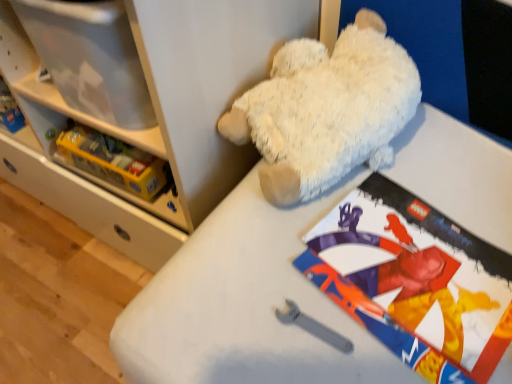
Where is `matte paper comic book at upper center`? matte paper comic book at upper center is located at coordinates (414, 281).

Where is `white plush teddy bear at upper center`? This screenshot has width=512, height=384. white plush teddy bear at upper center is located at coordinates 326,109.

The image size is (512, 384). Describe the element at coordinates (73, 111) in the screenshot. I see `yellow plastic lego box at left, arranged as the 1th shelf when viewed from the back` at that location.

The width and height of the screenshot is (512, 384). Find the location of `white plush bear at upper right, the second shelf when ordered from back to front`. white plush bear at upper right, the second shelf when ordered from back to front is located at coordinates (156, 114).

Where is `matte paper comic book at upper center`? matte paper comic book at upper center is located at coordinates (414, 281).

Considering the relative positions of white plush teddy bear at upper center and matte paper comic book at upper center in the image provided, is white plush teddy bear at upper center in front of matte paper comic book at upper center?

No, it is not.

Is white plush teddy bear at upper center next to matte paper comic book at upper center and touching it?

No, white plush teddy bear at upper center is not beside matte paper comic book at upper center.

What's the angular difference between white plush teddy bear at upper center and matte paper comic book at upper center's facing directions?

They differ by 6.56 degrees in their facing directions.

Is white plush teddy bear at upper center wider than matte paper comic book at upper center?

Correct, the width of white plush teddy bear at upper center exceeds that of matte paper comic book at upper center.

From a real-world perspective, is yellow plastic lego box at left, the second shelf in the front-to-back sequence, over white plush teddy bear at upper center?

Actually, yellow plastic lego box at left, the second shelf in the front-to-back sequence, is physically below white plush teddy bear at upper center in the real world.

Does yellow plastic lego box at left, arranged as the 1th shelf when viewed from the back, have a smaller size compared to white plush teddy bear at upper center?

Yes.

What's the angular difference between yellow plastic lego box at left, the second shelf in the front-to-back sequence, and white plush teddy bear at upper center's facing directions?

There is a 5.17-degree angle between the facing directions of yellow plastic lego box at left, the second shelf in the front-to-back sequence, and white plush teddy bear at upper center.

From a real-world perspective, which shelf is the 2nd one underneath the white plush teddy bear at upper center? Please provide its 2D coordinates.

[(73, 111)]

Considering the positions of point (429, 208) and point (168, 5), is point (429, 208) closer or farther from the camera than point (168, 5)?

Point (429, 208) is positioned farther from the camera compared to point (168, 5).

Is matte paper comic book at upper center at the left side of white plush bear at upper right, the second shelf when ordered from back to front?

No, matte paper comic book at upper center is not to the left of white plush bear at upper right, the second shelf when ordered from back to front.

Does matte paper comic book at upper center turn towards white plush bear at upper right, the second shelf when ordered from back to front?

No, matte paper comic book at upper center does not turn towards white plush bear at upper right, the second shelf when ordered from back to front.

How different are the orientations of matte paper comic book at upper center and white plush bear at upper right, acting as the first shelf starting from the front, in degrees?

There is a 8.73-degree angle between the facing directions of matte paper comic book at upper center and white plush bear at upper right, acting as the first shelf starting from the front.

Are white plush bear at upper right, the second shelf when ordered from back to front, and white plush teddy bear at upper center making contact?

No, white plush bear at upper right, the second shelf when ordered from back to front, is not making contact with white plush teddy bear at upper center.

Which object is positioned more to the right, white plush bear at upper right, acting as the first shelf starting from the front, or white plush teddy bear at upper center?

From the viewer's perspective, white plush teddy bear at upper center appears more on the right side.

How different are the orientations of white plush bear at upper right, acting as the first shelf starting from the front, and white plush teddy bear at upper center in degrees?

white plush bear at upper right, acting as the first shelf starting from the front, and white plush teddy bear at upper center are facing 2.17 degrees away from each other.

Considering the sizes of objects yellow plastic lego box at left, the second shelf in the front-to-back sequence, and white plush bear at upper right, acting as the first shelf starting from the front, in the image provided, who is wider, yellow plastic lego box at left, the second shelf in the front-to-back sequence, or white plush bear at upper right, acting as the first shelf starting from the front,?

Wider between the two is white plush bear at upper right, acting as the first shelf starting from the front.

From a real-world perspective, is yellow plastic lego box at left, the second shelf in the front-to-back sequence, physically located above or below white plush bear at upper right, acting as the first shelf starting from the front?

yellow plastic lego box at left, the second shelf in the front-to-back sequence, is situated lower than white plush bear at upper right, acting as the first shelf starting from the front, in the real world.

Which is behind, point (182, 214) or point (178, 39)?

The point (182, 214) is farther from the camera.

Is yellow plastic lego box at left, arranged as the 1th shelf when viewed from the back, positioned far away from white plush bear at upper right, the second shelf when ordered from back to front?

That's not correct — yellow plastic lego box at left, arranged as the 1th shelf when viewed from the back, is a little close to white plush bear at upper right, the second shelf when ordered from back to front.

From the image's perspective, which is above, white plush bear at upper right, the second shelf when ordered from back to front, or matte paper comic book at upper center?

white plush bear at upper right, the second shelf when ordered from back to front, appears higher in the image.

Consider the image. Is white plush bear at upper right, the second shelf when ordered from back to front, directly adjacent to matte paper comic book at upper center?

white plush bear at upper right, the second shelf when ordered from back to front, and matte paper comic book at upper center are clearly separated.

Does white plush bear at upper right, acting as the first shelf starting from the front, have a lesser height compared to matte paper comic book at upper center?

No, white plush bear at upper right, acting as the first shelf starting from the front, is not shorter than matte paper comic book at upper center.

From the image's perspective, who appears lower, white plush bear at upper right, the second shelf when ordered from back to front, or yellow plastic lego box at left, arranged as the 1th shelf when viewed from the back?

yellow plastic lego box at left, arranged as the 1th shelf when viewed from the back, is shown below in the image.

Looking at this image, does white plush bear at upper right, the second shelf when ordered from back to front, have a lesser height compared to yellow plastic lego box at left, the second shelf in the front-to-back sequence?

No, white plush bear at upper right, the second shelf when ordered from back to front, is not shorter than yellow plastic lego box at left, the second shelf in the front-to-back sequence.

Which object is positioned more to the left, white plush bear at upper right, the second shelf when ordered from back to front, or yellow plastic lego box at left, the second shelf in the front-to-back sequence?

white plush bear at upper right, the second shelf when ordered from back to front.

This screenshot has height=384, width=512. Find the location of `teddy bear on the left of the matte paper comic book at upper center`. teddy bear on the left of the matte paper comic book at upper center is located at coordinates (326, 109).

From a real-world perspective, which shelf is the 2nd one underneath the white plush teddy bear at upper center? Please provide its 2D coordinates.

[(73, 111)]

Based on their spatial positions, is matte paper comic book at upper center or white plush bear at upper right, the second shelf when ordered from back to front, further from yellow plastic lego box at left, the second shelf in the front-to-back sequence?

The object further to yellow plastic lego box at left, the second shelf in the front-to-back sequence, is matte paper comic book at upper center.

From the image, which object appears to be farther from white plush bear at upper right, acting as the first shelf starting from the front, yellow plastic lego box at left, arranged as the 1th shelf when viewed from the back, or white plush teddy bear at upper center?

Based on the image, white plush teddy bear at upper center appears to be further to white plush bear at upper right, acting as the first shelf starting from the front.

Which object lies nearer to the anchor point matte paper comic book at upper center, yellow plastic lego box at left, arranged as the 1th shelf when viewed from the back, or white plush bear at upper right, acting as the first shelf starting from the front?

white plush bear at upper right, acting as the first shelf starting from the front, is positioned closer to the anchor matte paper comic book at upper center.

When comparing their distances from white plush teddy bear at upper center, does white plush bear at upper right, the second shelf when ordered from back to front, or yellow plastic lego box at left, the second shelf in the front-to-back sequence, seem closer?

white plush bear at upper right, the second shelf when ordered from back to front, is positioned closer to the anchor white plush teddy bear at upper center.

When comparing their distances from white plush teddy bear at upper center, does yellow plastic lego box at left, the second shelf in the front-to-back sequence, or white plush bear at upper right, acting as the first shelf starting from the front, seem further?

Among the two, yellow plastic lego box at left, the second shelf in the front-to-back sequence, is located further to white plush teddy bear at upper center.

Based on their spatial positions, is matte paper comic book at upper center or yellow plastic lego box at left, arranged as the 1th shelf when viewed from the back, further from white plush bear at upper right, acting as the first shelf starting from the front?

matte paper comic book at upper center lies further to white plush bear at upper right, acting as the first shelf starting from the front, than the other object.

Considering their positions, is matte paper comic book at upper center positioned further to yellow plastic lego box at left, the second shelf in the front-to-back sequence, than white plush teddy bear at upper center?

Among the two, matte paper comic book at upper center is located further to yellow plastic lego box at left, the second shelf in the front-to-back sequence.

Which object lies further to the anchor point white plush bear at upper right, the second shelf when ordered from back to front, yellow plastic lego box at left, the second shelf in the front-to-back sequence, or matte paper comic book at upper center?

Based on the image, matte paper comic book at upper center appears to be further to white plush bear at upper right, the second shelf when ordered from back to front.

Find the location of a particular element. shelf located between white plush bear at upper right, acting as the first shelf starting from the front, and white plush teddy bear at upper center in the left-right direction is located at coordinates click(73, 111).

At what (x,y) coordinates should I click in order to perform the action: click on shelf between white plush bear at upper right, acting as the first shelf starting from the front, and matte paper comic book at upper center, in the horizontal direction. Please return your answer as a coordinate pair (x, y). Looking at the image, I should click on (73, 111).

This screenshot has width=512, height=384. Identify the location of teddy bear between white plush bear at upper right, acting as the first shelf starting from the front, and matte paper comic book at upper center, in the horizontal direction. (326, 109).

Locate an element on the screen. The image size is (512, 384). teddy bear between yellow plastic lego box at left, arranged as the 1th shelf when viewed from the back, and matte paper comic book at upper center is located at coordinates (326, 109).